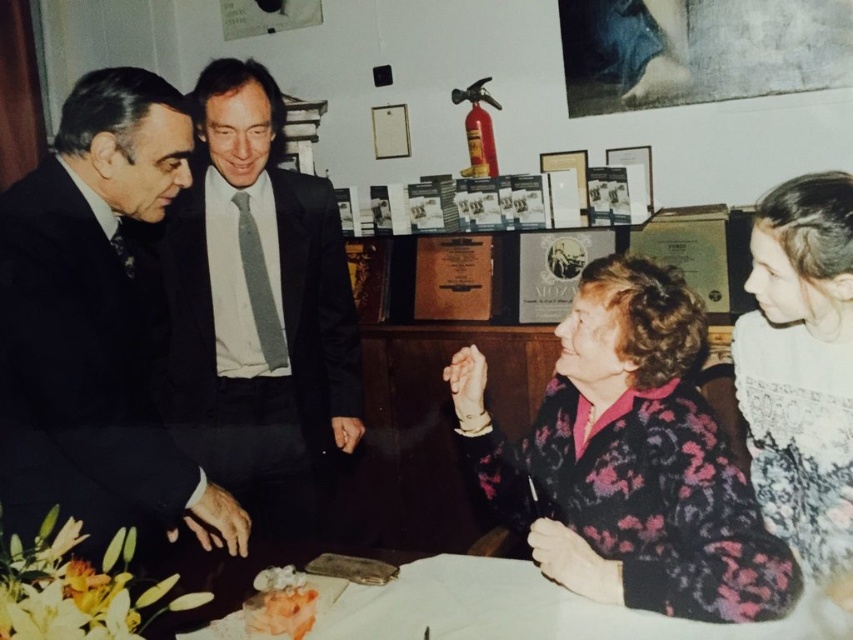
Question: Considering the relative positions of floral-patterned sweater at lower right and white lace dress at right in the image provided, where is floral-patterned sweater at lower right located with respect to white lace dress at right?

Choices:
 (A) below
 (B) above

Answer: (A)

Question: Does floral-patterned sweater at lower right come in front of orange frosted cake at lower center?

Choices:
 (A) no
 (B) yes

Answer: (B)

Question: Which of these objects is positioned farthest from the orange frosted cake at lower center?

Choices:
 (A) floral-patterned sweater at lower right
 (B) dark gray suit at center
 (C) dark suit at left
 (D) white lace dress at right

Answer: (D)

Question: Which of these objects is positioned closest to the dark gray suit at center?

Choices:
 (A) dark suit at left
 (B) floral-patterned sweater at lower right
 (C) orange frosted cake at lower center

Answer: (A)

Question: Does dark gray suit at center have a smaller size compared to orange frosted cake at lower center?

Choices:
 (A) yes
 (B) no

Answer: (B)

Question: Which point is closer to the camera taking this photo?

Choices:
 (A) (799, 317)
 (B) (637, 266)
 (C) (76, 304)
 (D) (248, 608)

Answer: (C)